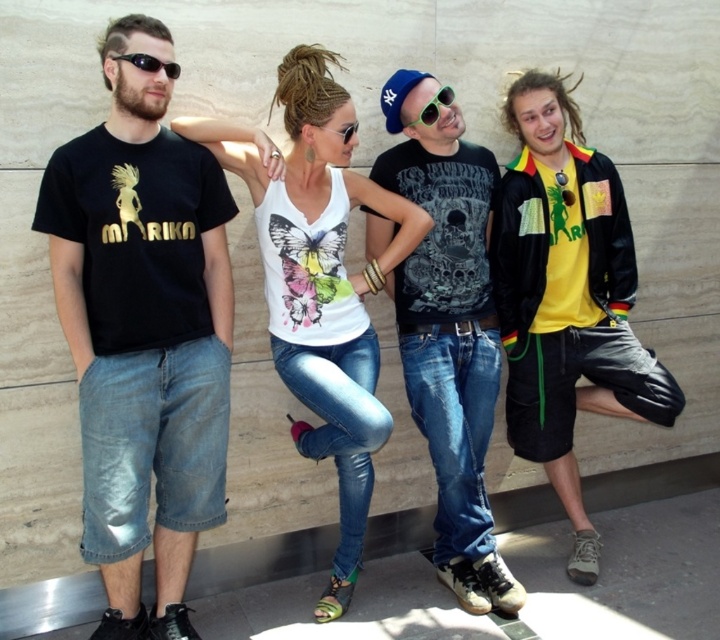
Question: Among these points, which one is nearest to the camera?

Choices:
 (A) (342, 141)
 (B) (454, 525)
 (C) (333, 580)
 (D) (166, 77)

Answer: (D)

Question: Does black plastic sunglasses at upper left have a larger size compared to sunglasses at center?

Choices:
 (A) yes
 (B) no

Answer: (B)

Question: Is black cotton t-shirt at left closer to the viewer compared to sunglasses at center?

Choices:
 (A) no
 (B) yes

Answer: (B)

Question: Which point is farther from the camera taking this photo?

Choices:
 (A) (351, 129)
 (B) (157, 60)
 (C) (341, 216)
 (D) (428, 100)

Answer: (D)

Question: In this image, where is white matte tank top at center located relative to matte black t-shirt at center?

Choices:
 (A) above
 (B) below

Answer: (A)

Question: Estimate the real-world distances between objects in this image. Which object is farther from the yellow matte shirt at center?

Choices:
 (A) clear plastic goggles at center
 (B) black plastic sunglasses at upper left
 (C) black cotton t-shirt at left

Answer: (B)